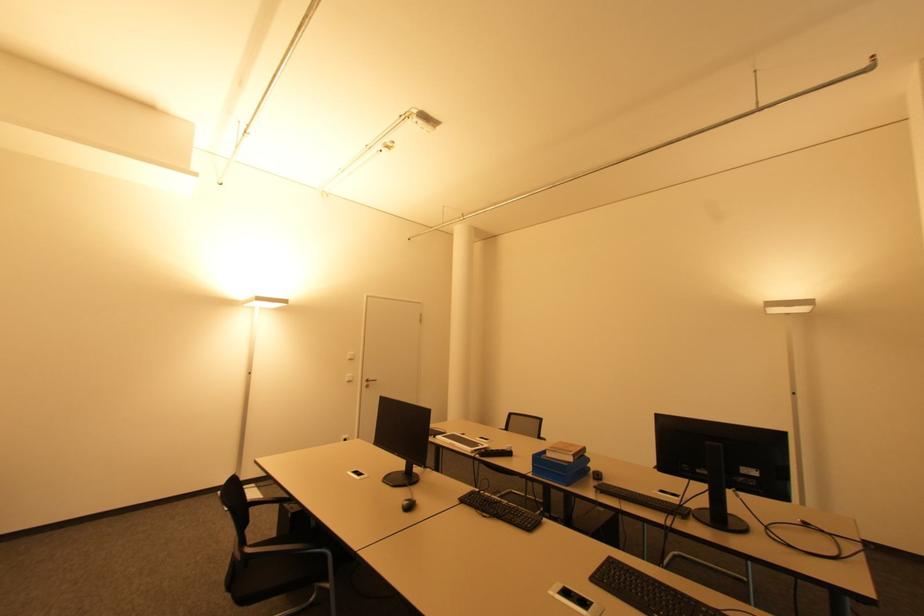
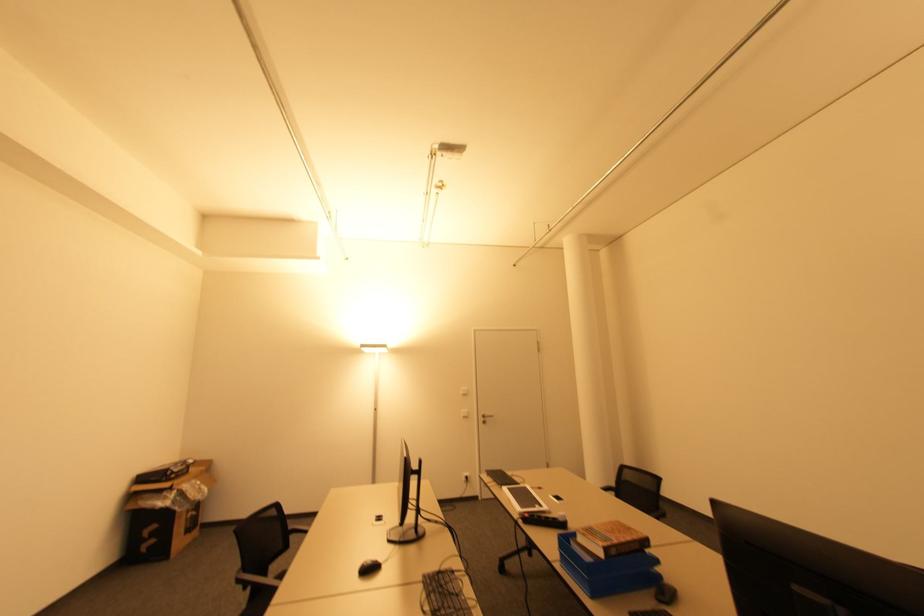
Find the pixel in the second image that matches (x=578, y=458) in the first image.

(615, 553)